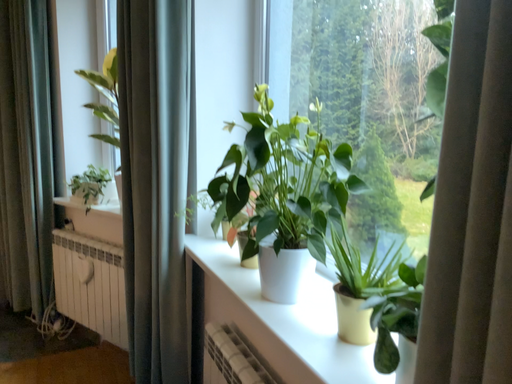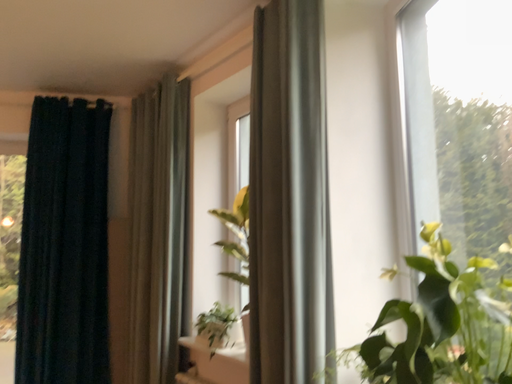
Question: Which way did the camera rotate in the video?

Choices:
 (A) rotated downward
 (B) rotated upward

Answer: (B)